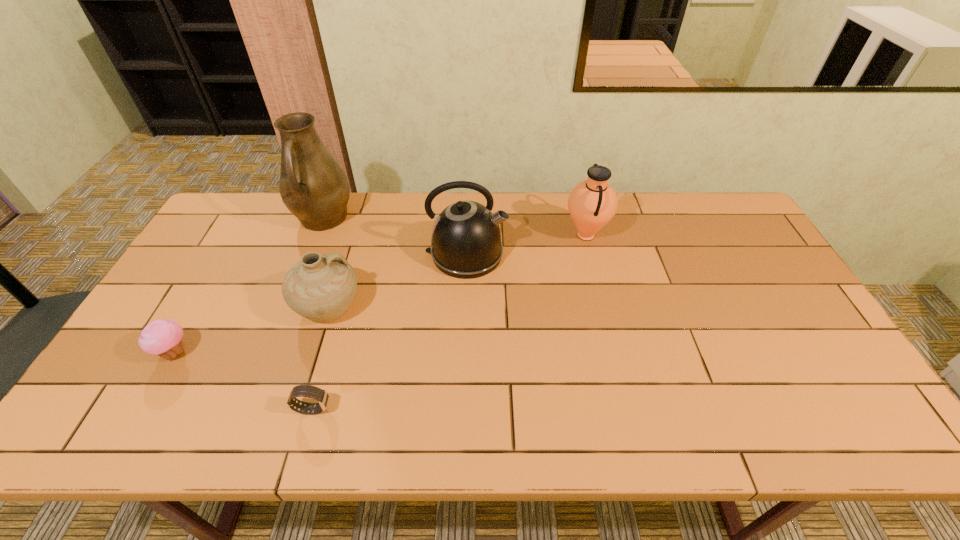
Locate an element on the screen. The height and width of the screenshot is (540, 960). free spot that satisfies the following two spatial constraints: 1. on the handle side of the right pitcher; 2. on the left side of the taller pitcher is located at coordinates (317, 235).

The image size is (960, 540). Identify the location of vacant space that satisfies the following two spatial constraints: 1. on the handle side of the left pitcher; 2. on the left side of the right pitcher. 317,235.